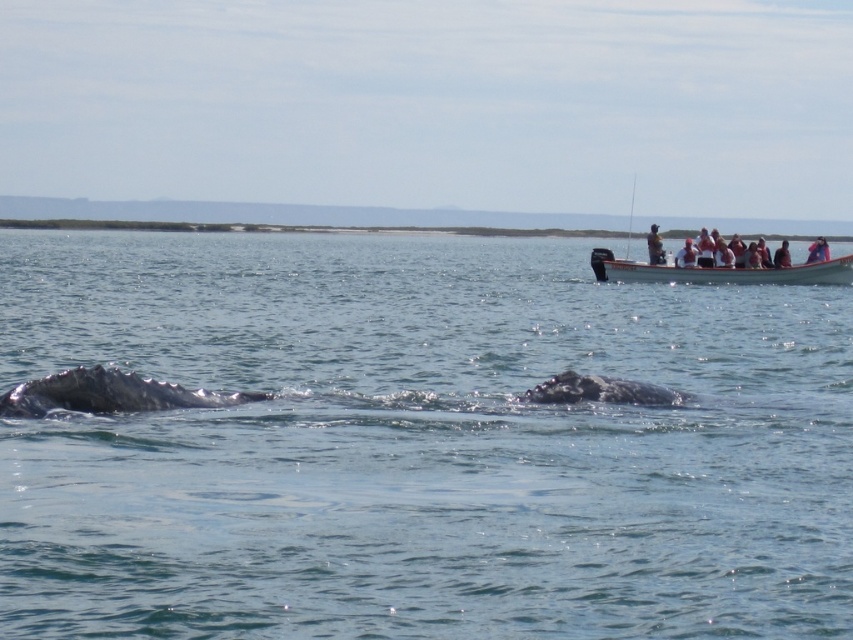
Question: Is gray matte whale at lower left wider than gray matte whale at center?

Choices:
 (A) no
 (B) yes

Answer: (B)

Question: Is light brown wooden paddle at upper right positioned at the back of light brown wooden boat at upper right?

Choices:
 (A) no
 (B) yes

Answer: (A)

Question: Which point is closer to the camera taking this photo?

Choices:
 (A) (231, 396)
 (B) (657, 241)
 (C) (624, 397)

Answer: (A)

Question: Estimate the real-world distances between objects in this image. Which object is closer to the white plastic boat at upper right?

Choices:
 (A) clear blue water at center
 (B) gray matte whale at lower left
 (C) white wooden boat at upper right

Answer: (C)

Question: Does clear blue water at center have a smaller size compared to gray matte whale at center?

Choices:
 (A) no
 (B) yes

Answer: (A)

Question: Based on their relative distances, which object is farther from the gray matte whale at lower left?

Choices:
 (A) gray matte whale at center
 (B) light brown wooden paddle at upper right

Answer: (B)